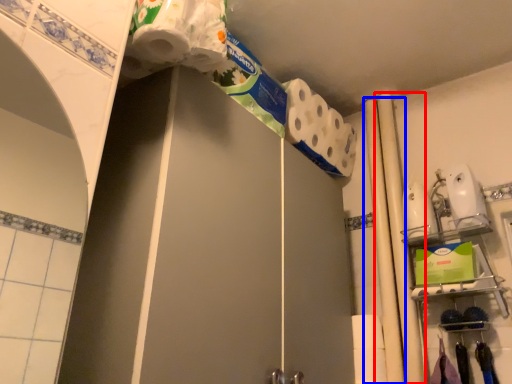
Question: Which object appears closest to the camera in this image, beam (highlighted by a red box) or beam (highlighted by a blue box)?

Choices:
 (A) beam
 (B) beam

Answer: (A)